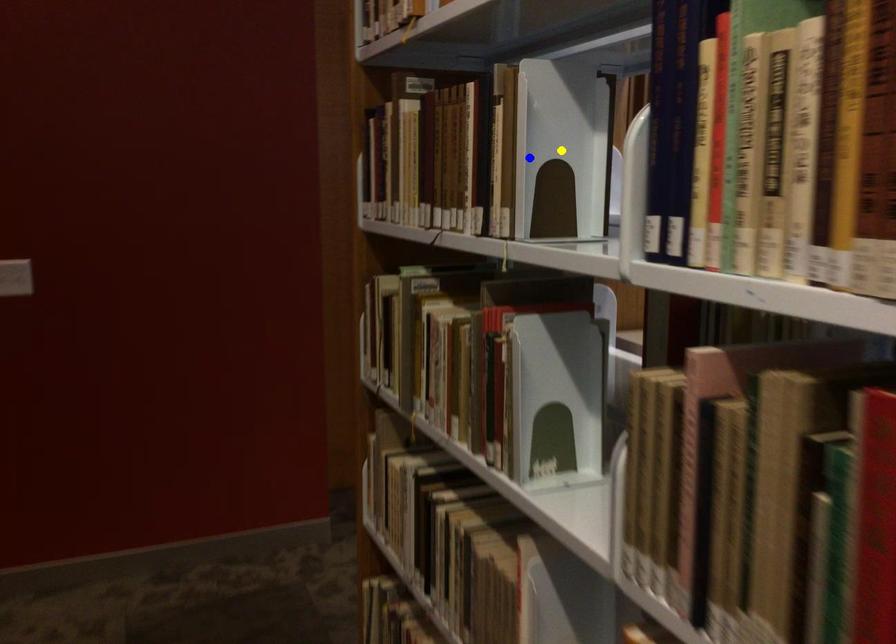
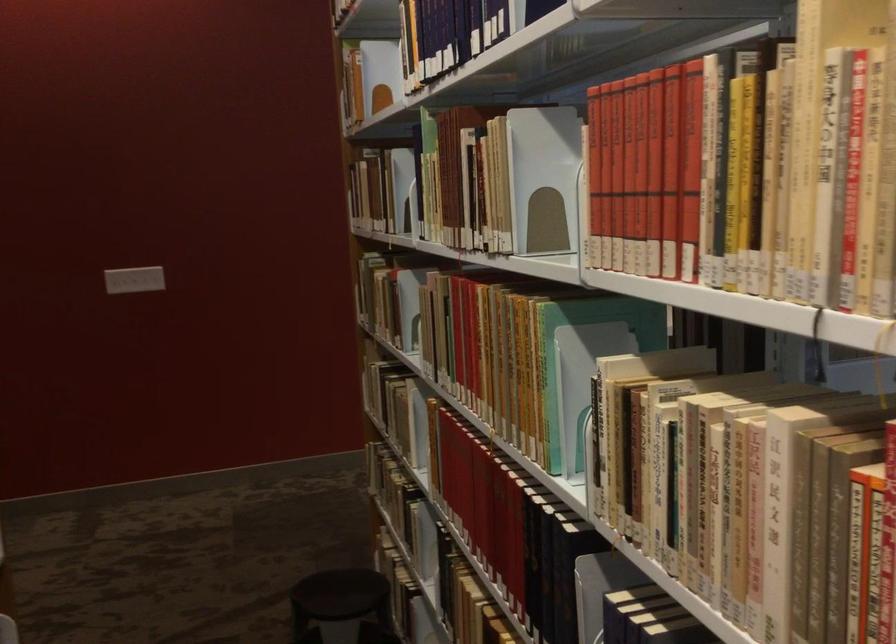
I am providing you with two images of the same scene from different viewpoints. Three points are marked in image1. Which point corresponds to a part or object that is occluded in image2?In image1, three points are marked. Which of them correspond to a part or object that is occluded in image2?Among the three points shown in image1, which one corresponds to a part or object that is no longer visible due to occlusion in image2?

Invisible in image2: green point, yellow point.